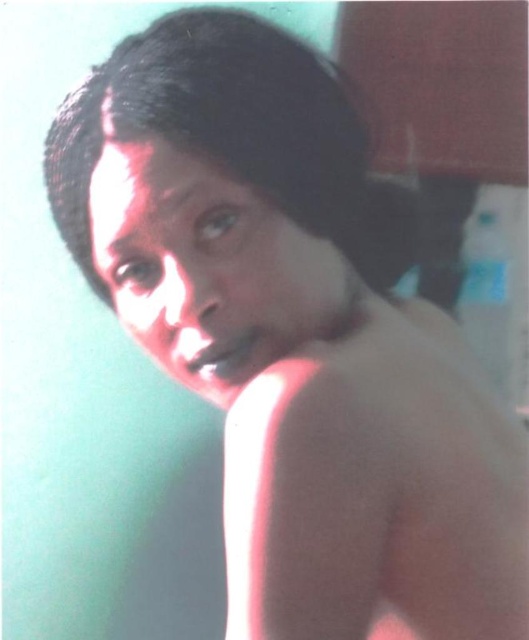
Question: Which point is closer to the camera taking this photo?

Choices:
 (A) (425, 403)
 (B) (245, 108)

Answer: (B)

Question: Is smooth skin at right positioned before black matte hair at center?

Choices:
 (A) yes
 (B) no

Answer: (A)

Question: Among these points, which one is nearest to the camera?

Choices:
 (A) (482, 609)
 (B) (245, 109)

Answer: (B)

Question: Is smooth skin at right below black matte hair at center?

Choices:
 (A) yes
 (B) no

Answer: (A)

Question: Can you confirm if smooth skin at right is positioned below black matte hair at center?

Choices:
 (A) yes
 (B) no

Answer: (A)